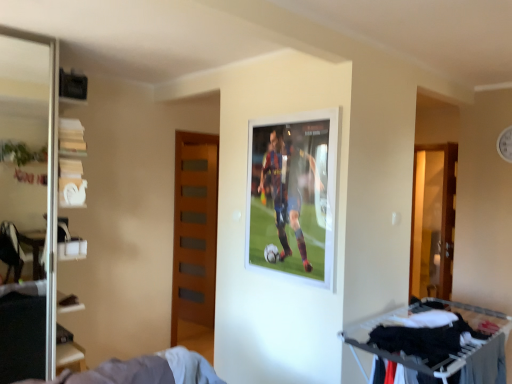
Question: Is point (37, 322) positioned closer to the camera than point (485, 311)?

Choices:
 (A) farther
 (B) closer

Answer: (A)

Question: From their relative heights in the image, would you say transparent glass screen door at left is taller or shorter than white fabric clothes rack at lower right?

Choices:
 (A) short
 (B) tall

Answer: (B)

Question: Which is nearer to the transparent glass screen door at left?

Choices:
 (A) white fabric clothes rack at lower right
 (B) white plastic shelves at left
 (C) wooden door at center-left

Answer: (B)

Question: Which is farther from the transparent glass screen door at left?

Choices:
 (A) white fabric clothes rack at lower right
 (B) white plastic shelves at left
 (C) wooden door at center-left

Answer: (A)